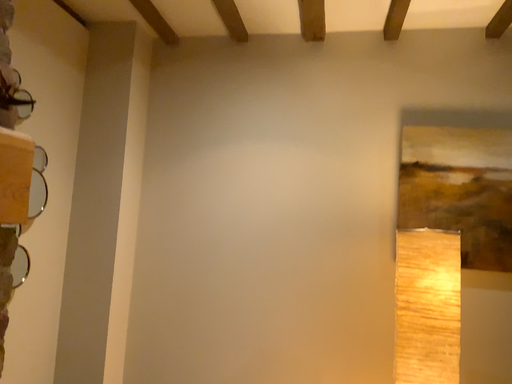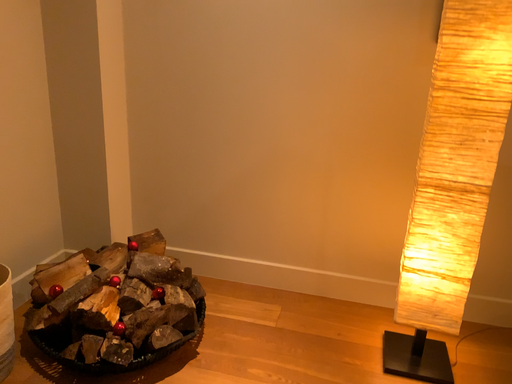
Question: Which way did the camera rotate in the video?

Choices:
 (A) rotated downward
 (B) rotated upward

Answer: (A)